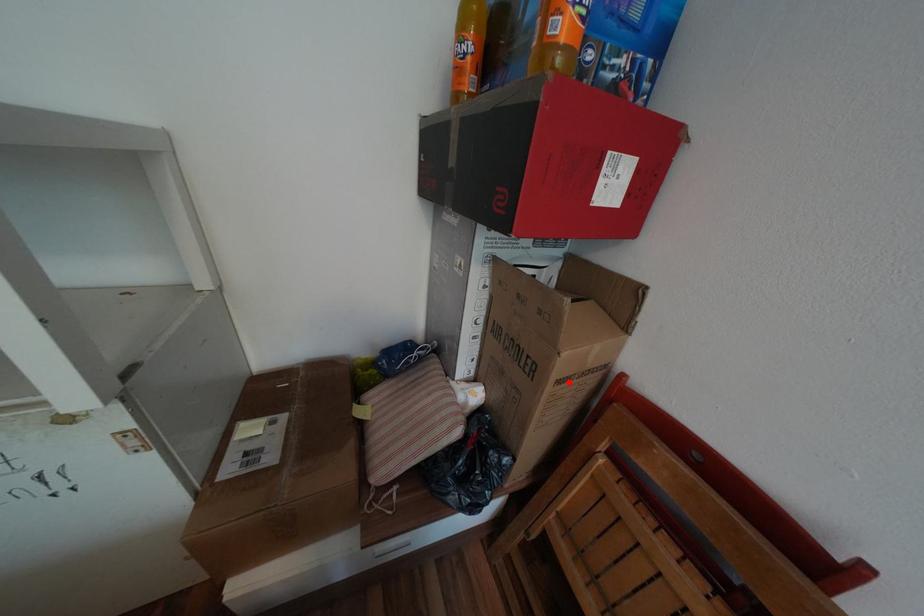
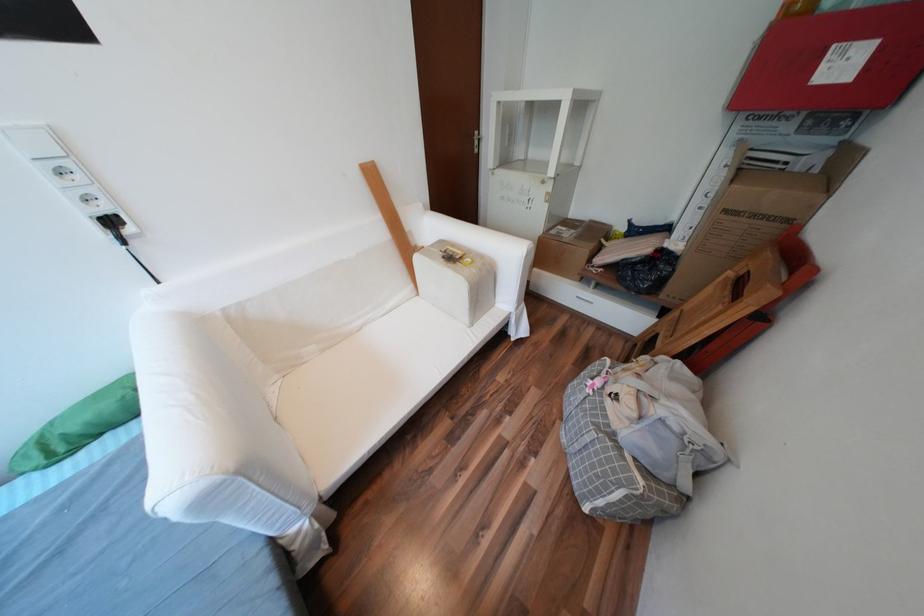
In the second image, find the point that corresponds to the highlighted location in the first image.

(736, 211)